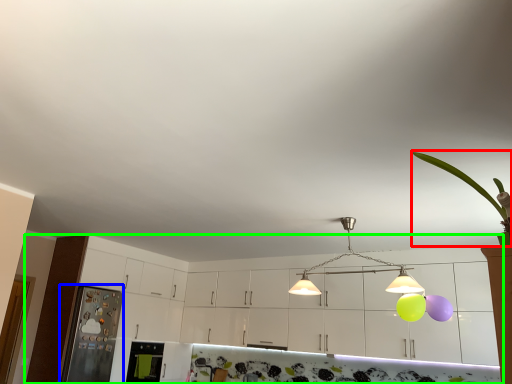
Question: Which is farther away from plant (highlighted by a red box)? appliance (highlighted by a blue box) or cabinetry (highlighted by a green box)?

Choices:
 (A) appliance
 (B) cabinetry

Answer: (A)